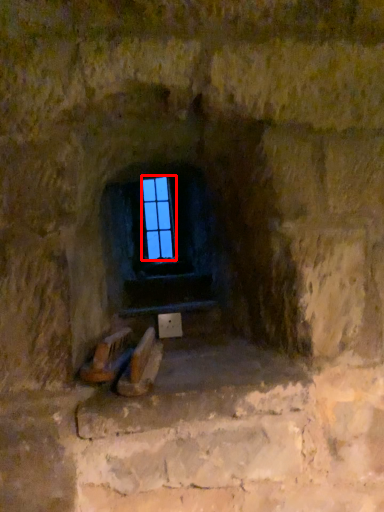
Question: From the image's perspective, what is the correct spatial relationship of glass window (annotated by the red box) in relation to stairwell?

Choices:
 (A) below
 (B) above

Answer: (B)